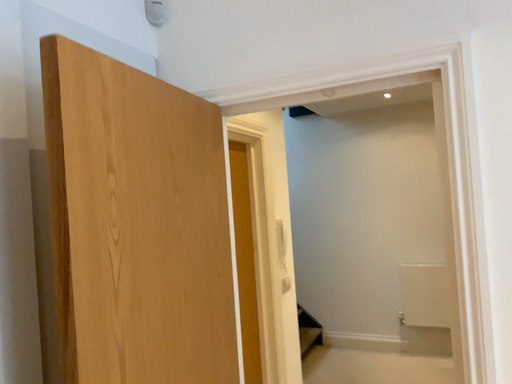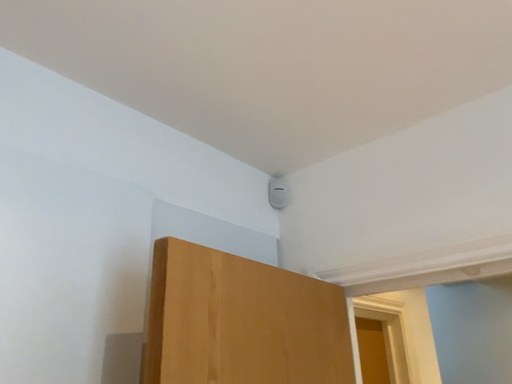
Question: How did the camera likely rotate when shooting the video?

Choices:
 (A) rotated left
 (B) rotated right

Answer: (A)